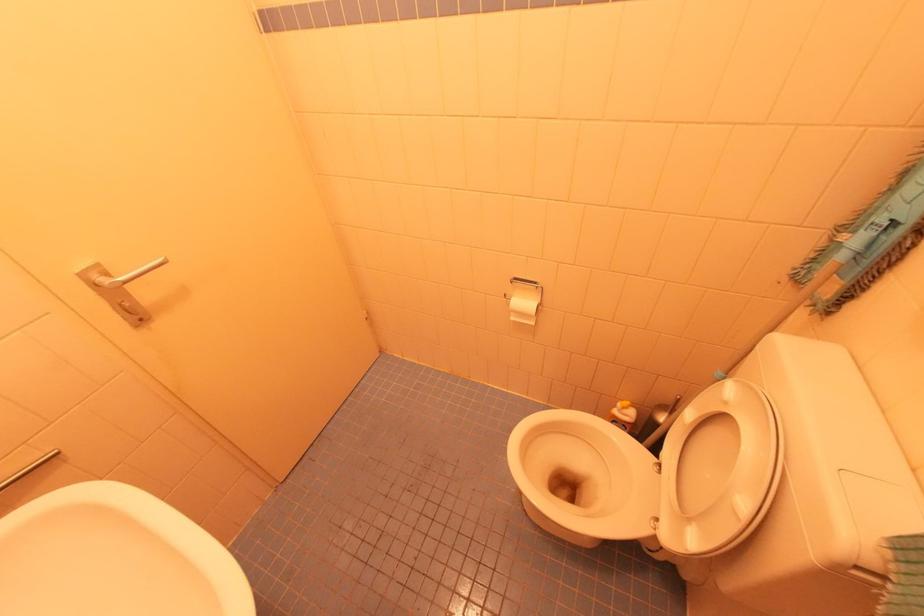
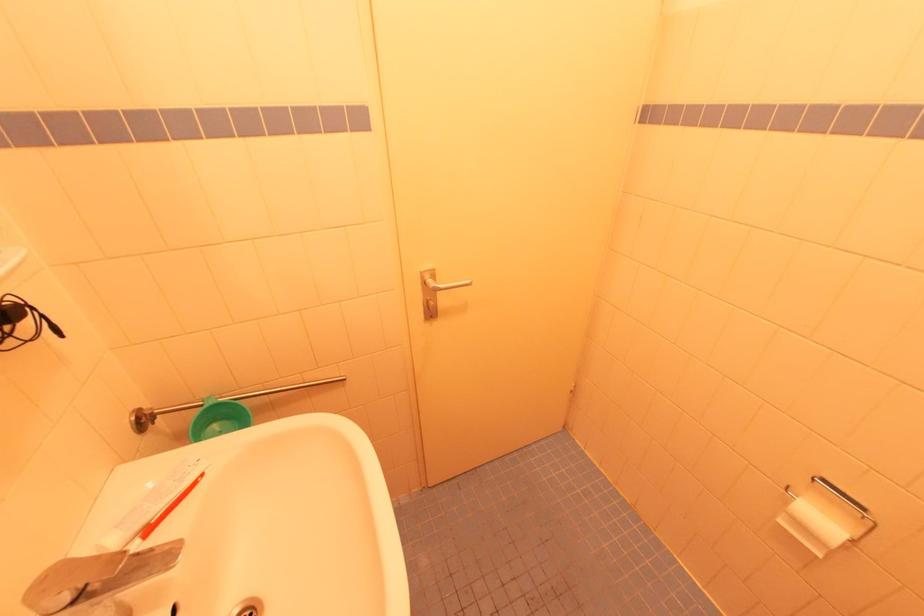
Where in the second image is the point corresponding to (x=79, y=272) from the first image?

(423, 272)